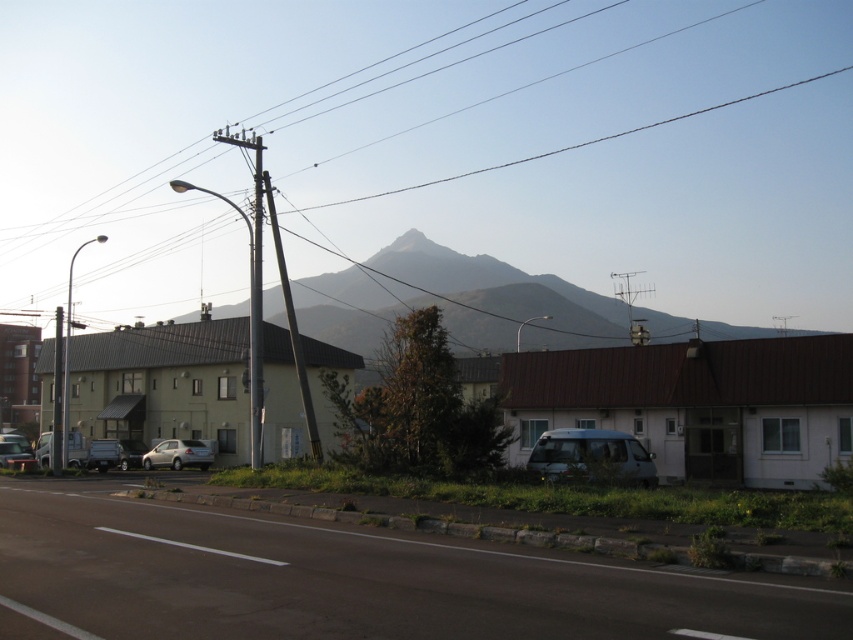
Question: Does gray rocky mountain at center appear on the left side of metallic gray telegraph pole at center?

Choices:
 (A) yes
 (B) no

Answer: (B)

Question: Does smooth gray pole at center appear under smooth wood telegraph pole at center?

Choices:
 (A) yes
 (B) no

Answer: (A)

Question: Which point appears farthest from the camera in this image?

Choices:
 (A) (248, 323)
 (B) (279, 257)
 (C) (332, 225)
 (D) (490, 346)

Answer: (C)

Question: Which object appears closest to the camera in this image?

Choices:
 (A) metallic gray telegraph pole at center
 (B) metallic wire at upper center
 (C) silver metallic van at center

Answer: (C)

Question: In this image, where is satin silver car at lower left located relative to metallic gray telegraph pole at left?

Choices:
 (A) above
 (B) below

Answer: (B)

Question: Which point appears closest to the camera in this image?

Choices:
 (A) (61, 353)
 (B) (582, 442)
 (C) (605, 26)
 (D) (233, 308)

Answer: (B)